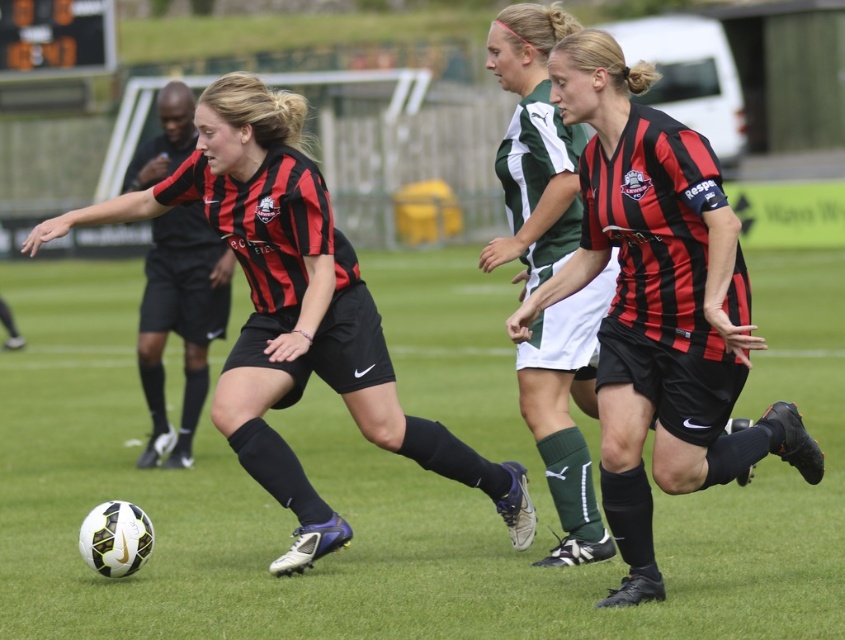
Question: From the image, what is the correct spatial relationship of matte black soccer ball at lower left in relation to matte black shorts at center?

Choices:
 (A) left
 (B) right

Answer: (A)

Question: Does matte black soccer ball at lower left have a lesser width compared to black matte referee at center?

Choices:
 (A) no
 (B) yes

Answer: (A)

Question: Estimate the real-world distances between objects in this image. Which object is farther from the matte black soccer ball at lower left?

Choices:
 (A) black matte referee at center
 (B) green artificial turf at center
 (C) matte black shorts at center
 (D) matte black jersey at center

Answer: (A)

Question: Which object is farther from the camera taking this photo?

Choices:
 (A) green artificial turf at center
 (B) matte black soccer ball at lower left

Answer: (B)

Question: Which of the following is the closest to the observer?

Choices:
 (A) (385, 356)
 (B) (180, 438)

Answer: (A)

Question: Is green artificial turf at center bigger than black matte referee at center?

Choices:
 (A) no
 (B) yes

Answer: (B)